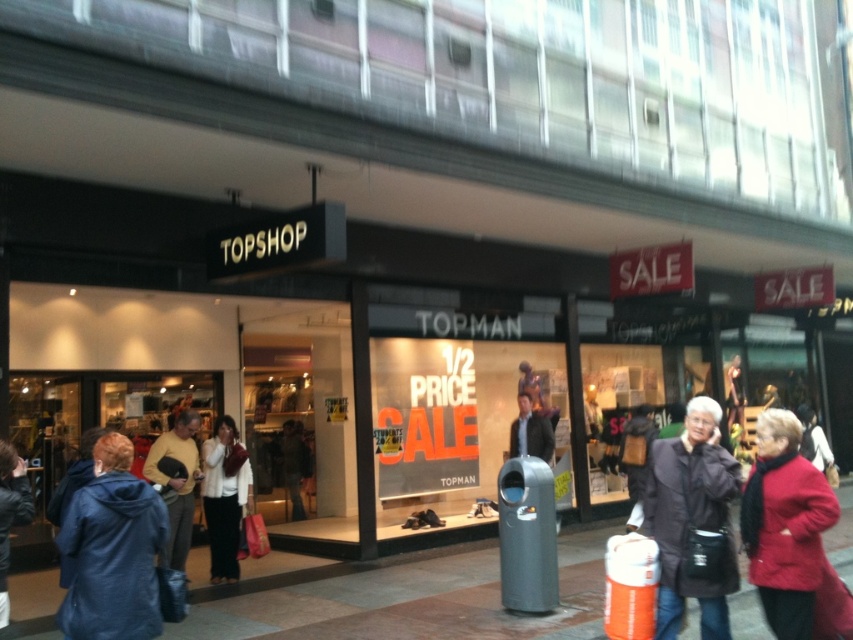
You are a delivery person trying to park your 2.5 meter long cart between the concrete pavement at center and the dark brown leather jacket at center. Can your cart fit in the space between them?

The concrete pavement at center occupies less space than dark brown leather jacket at center, so the space between them may not be sufficient for a 2.5 meter long cart. Please check the available space carefully before attempting to park.

You are a customer shopping for jackets and see both the blue hooded jacket at lower left and the dark blue jacket at lower left displayed in the Topshop store window. Which jacket has a greater width?

The blue hooded jacket at lower left has a greater width than the dark blue jacket at lower left.

You are a delivery person trying to place a large box on the ground between the concrete pavement at center and the dark brown leather jacket at center. Can you fit the box there if the box is 1.2 meters wide?

The concrete pavement at center might be wider than dark brown leather jacket at center, but the exact width isn not specified. Without knowing the actual width of the space between them, it is uncertain if the box will fit. Please measure the available space before placing the box.